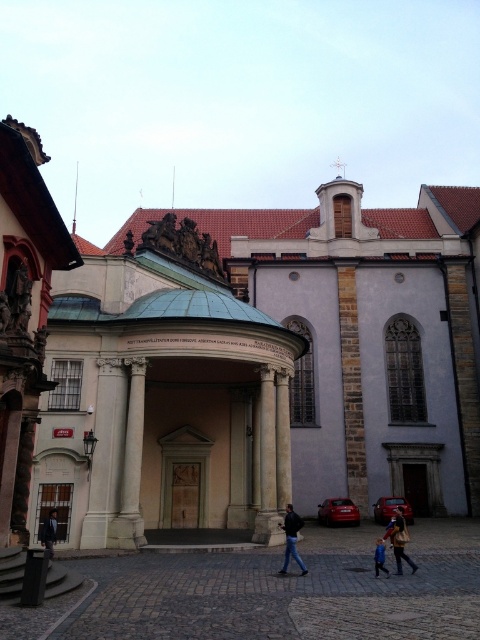
Between dark blue suit at center and blue denim jeans at lower center, which one has more height?

With more height is blue denim jeans at lower center.

Which is more to the right, dark blue suit at center or blue denim jeans at lower center?

blue denim jeans at lower center is more to the right.

Does point (51, 538) lie in front of point (384, 570)?

No.

This screenshot has width=480, height=640. What are the coordinates of `dark blue suit at center` in the screenshot? It's located at (49, 531).

Can you confirm if brown leather jacket at lower center is thinner than dark blue suit at center?

In fact, brown leather jacket at lower center might be wider than dark blue suit at center.

Looking at this image, is brown leather jacket at lower center to the right of dark blue suit at center from the viewer's perspective?

Correct, you'll find brown leather jacket at lower center to the right of dark blue suit at center.

Who is more forward, (397,570) or (48,540)?

Point (397,570)

Identify the location of brown leather jacket at lower center. This screenshot has width=480, height=640. (399, 540).

Can you confirm if stone church at center is positioned below brown stone door at center?

No.

Where is `stone church at center`? The image size is (480, 640). stone church at center is located at coordinates (259, 360).

Who is more distant from viewer, (352, 225) or (196, 522)?

Positioned behind is point (352, 225).

Locate an element on the screen. This screenshot has height=640, width=480. stone church at center is located at coordinates (259, 360).